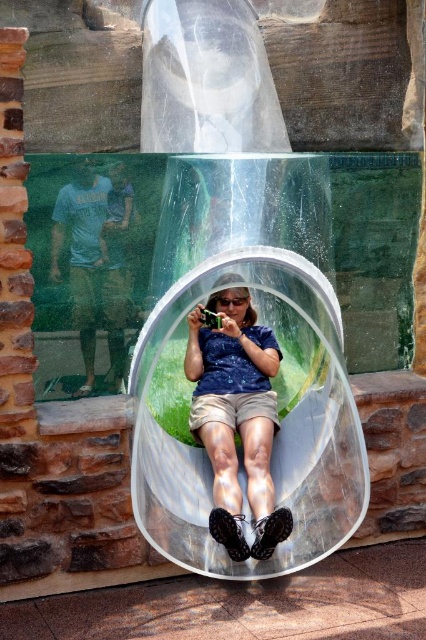
Which is below, transparent plastic bubble at center or light blue t-shirt at left?

transparent plastic bubble at center

Which is more to the right, transparent plastic bubble at center or light blue t-shirt at left?

Positioned to the right is transparent plastic bubble at center.

Identify the location of transparent plastic bubble at center. (276, 435).

Which is in front, point (311, 374) or point (253, 556)?

Point (253, 556) is in front.

Based on the photo, who is higher up, transparent plastic bubble at center or matte blue shirt at center?

Positioned higher is transparent plastic bubble at center.

Is point (155, 365) more distant than point (259, 460)?

Yes, it is behind point (259, 460).

Identify the location of transparent plastic bubble at center. (276, 435).

Which is more to the right, matte blue shirt at center or light blue t-shirt at left?

From the viewer's perspective, matte blue shirt at center appears more on the right side.

Does matte blue shirt at center come behind light blue t-shirt at left?

No, matte blue shirt at center is closer to the viewer.

Is point (256, 408) in front of point (115, 323)?

Yes.

Image resolution: width=426 pixels, height=640 pixels. What are the coordinates of `matte blue shirt at center` in the screenshot? It's located at (236, 417).